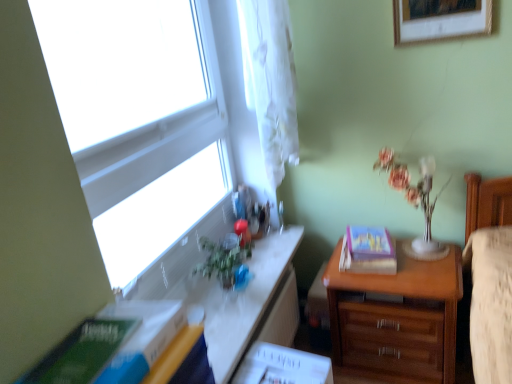
Question: Is green matte paperback book at lower left, the first paperback book positioned from the left, aimed at hardcover book at right, which is the second paperback book in front-to-back order?

Choices:
 (A) yes
 (B) no

Answer: (B)

Question: From the image's perspective, is green matte paperback book at lower left, positioned as the second paperback book in back-to-front order, below hardcover book at right, which is the second paperback book in front-to-back order?

Choices:
 (A) no
 (B) yes

Answer: (B)

Question: From the image's perspective, is green matte paperback book at lower left, the first paperback book positioned from the left, above hardcover book at right, arranged as the 2th paperback book when viewed from the left?

Choices:
 (A) yes
 (B) no

Answer: (B)

Question: From a real-world perspective, is green matte paperback book at lower left, the first paperback book positioned from the left, on top of hardcover book at right, placed as the 1th paperback book when sorted from back to front?

Choices:
 (A) no
 (B) yes

Answer: (B)

Question: Is green matte paperback book at lower left, the first paperback book when ordered from front to back, located outside hardcover book at right, which appears as the first paperback book when viewed from the right?

Choices:
 (A) yes
 (B) no

Answer: (A)

Question: From a real-world perspective, is green matte paperback book at lower left, marked as the second paperback book in a right-to-left arrangement, below hardcover book at right, placed as the 1th paperback book when sorted from back to front?

Choices:
 (A) no
 (B) yes

Answer: (A)

Question: Would you say transparent glass window at upper left contains translucent glass vase at upper right?

Choices:
 (A) yes
 (B) no

Answer: (B)

Question: Can you see transparent glass window at upper left touching translucent glass vase at upper right?

Choices:
 (A) no
 (B) yes

Answer: (A)

Question: From the image's perspective, is transparent glass window at upper left over translucent glass vase at upper right?

Choices:
 (A) no
 (B) yes

Answer: (B)

Question: Considering the relative sizes of transparent glass window at upper left and translucent glass vase at upper right in the image provided, is transparent glass window at upper left bigger than translucent glass vase at upper right?

Choices:
 (A) no
 (B) yes

Answer: (B)

Question: Is transparent glass window at upper left thinner than translucent glass vase at upper right?

Choices:
 (A) yes
 (B) no

Answer: (A)

Question: Is there a large distance between transparent glass window at upper left and translucent glass vase at upper right?

Choices:
 (A) no
 (B) yes

Answer: (B)

Question: Considering the relative sizes of translucent glass vase at upper right and wooden picture frame at upper right in the image provided, is translucent glass vase at upper right thinner than wooden picture frame at upper right?

Choices:
 (A) yes
 (B) no

Answer: (B)